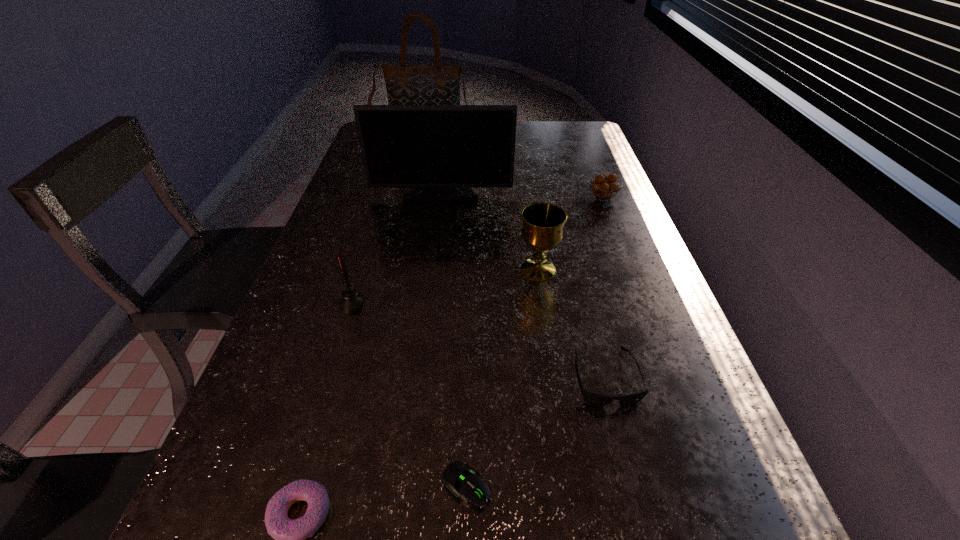
Where is `unoccupied area between the farthest object and the fourth farthest object`? unoccupied area between the farthest object and the fourth farthest object is located at coordinates click(481, 201).

This screenshot has width=960, height=540. In order to click on free spot between the second tallest object and the fifth nearest object in this screenshot , I will do `click(490, 231)`.

At what (x,y) coordinates should I click in order to perform the action: click on vacant space in between the fifth farthest object and the shortest object. Please return your answer as a coordinate pair (x, y). The width and height of the screenshot is (960, 540). Looking at the image, I should click on (409, 394).

Find the location of a particular element. free spot between the third nearest object and the second tallest object is located at coordinates (523, 285).

At what (x,y) coordinates should I click in order to perform the action: click on vacant area that lies between the orange fruit and the computer mouse. Please return your answer as a coordinate pair (x, y). Looking at the image, I should click on (535, 341).

Locate which object ranks in proximity to the computer mouse. Please provide its 2D coordinates. Your answer should be formatted as a tuple, i.e. [(x, y)], where the tuple contains the x and y coordinates of a point satisfying the conditions above.

[(290, 535)]

Where is `the seventh closest object to the computer mouse`? the seventh closest object to the computer mouse is located at coordinates (439, 84).

Where is `vacant point that satisfies the following two spatial constraints: 1. on the front-facing side of the handbag; 2. on the left side of the computer mouse`? This screenshot has width=960, height=540. vacant point that satisfies the following two spatial constraints: 1. on the front-facing side of the handbag; 2. on the left side of the computer mouse is located at coordinates (348, 485).

Locate an element on the screen. free region that satisfies the following two spatial constraints: 1. on the front-facing side of the farthest object; 2. on the left side of the rightmost object is located at coordinates (411, 197).